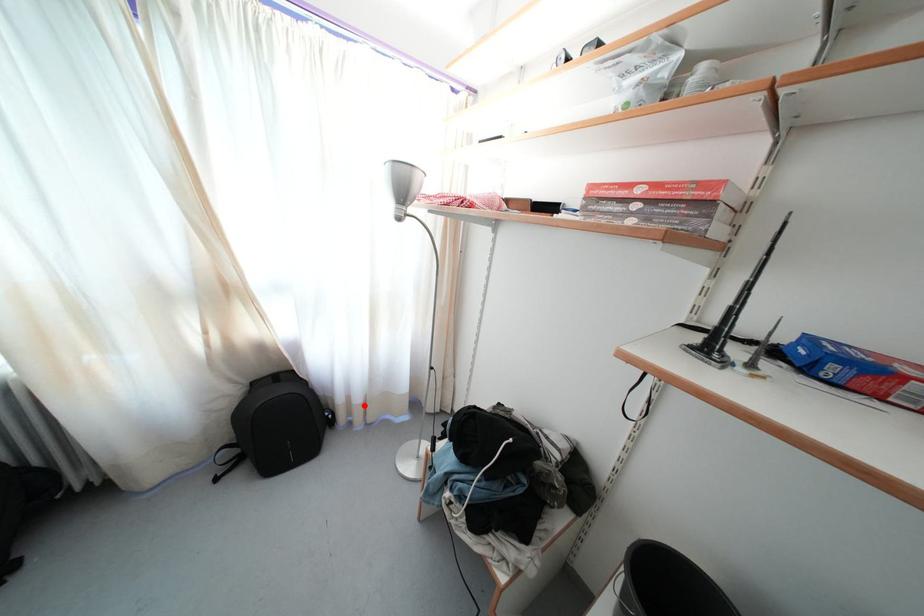
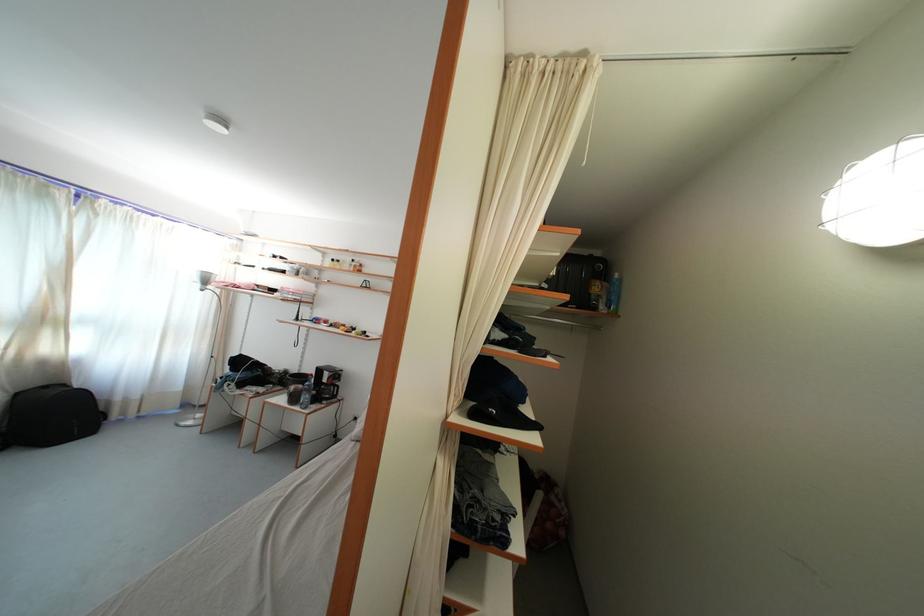
Locate, in the second image, the point that corresponds to the highlighted location in the first image.

(141, 403)